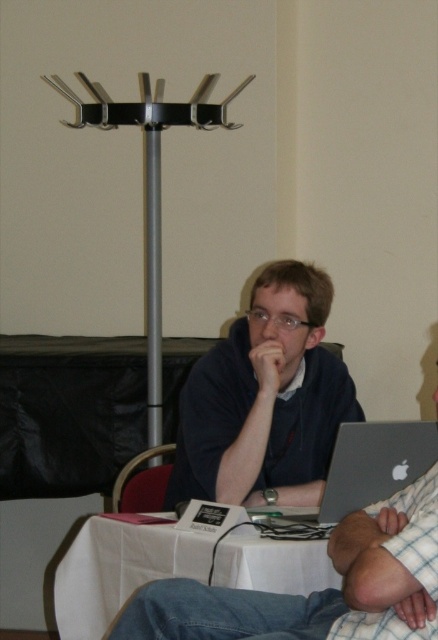
You are standing at the point labeled point (x=398, y=632) and want to take a photo of the scene. If your camera is 1.77 meters away from you, will it be able to capture the entire scene in the image?

The point labeled point (x=398, y=632) and the camera are 1.77 meters apart, so yes, the camera can capture the entire scene as it is positioned at the correct distance.

You are sitting at the white cloth table at center and want to reach the silver metallic laptop at center. Which direction do you need to move your hand to reach it?

Since the white cloth table at center is in front of the silver metallic laptop at center, you would need to move your hand backward to reach the silver metallic laptop at center.

Looking at this image, you are a delivery person who needs to place a small package between the matte black shirt at center and the red fabric chair at lower left. The package is 16 inches long. Can you fit it between them without moving either object?

→ The distance between the matte black shirt at center and the red fabric chair at lower left is 17.00 inches. Since the package is 16 inches long, it can fit comfortably between them without needing to move either object.